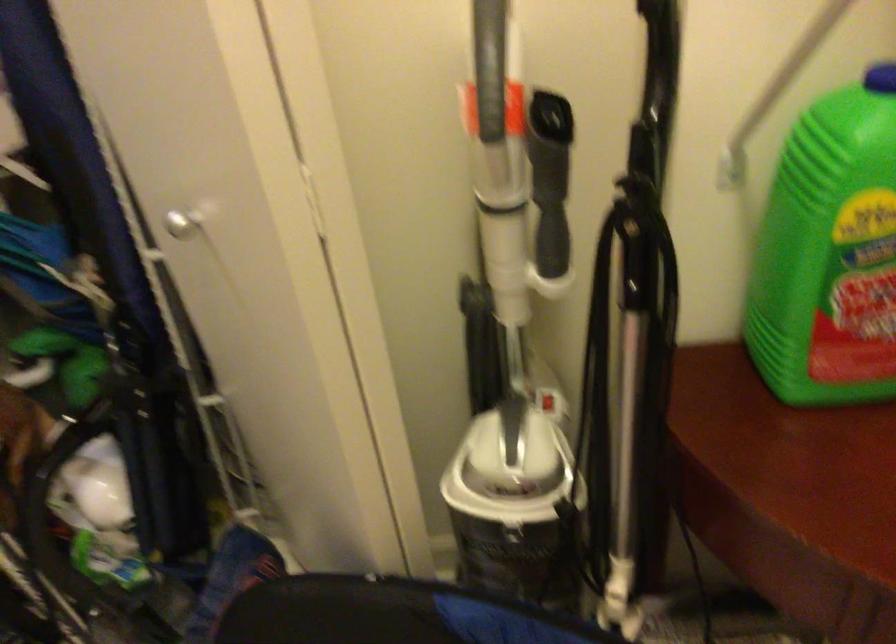
Where is `black vacuum handle`? black vacuum handle is located at coordinates (633, 348).